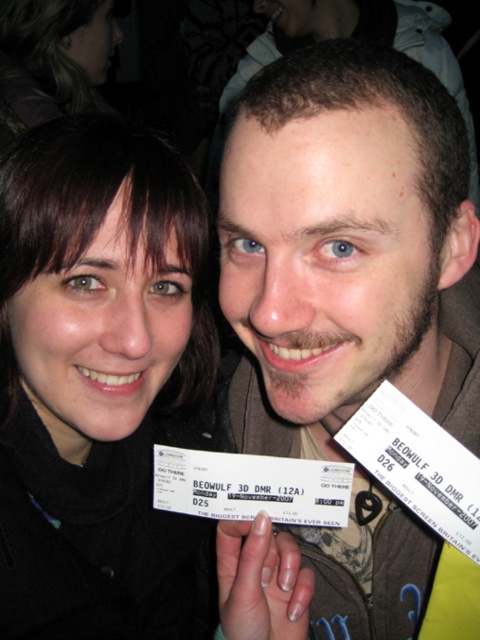
You are a photographer who needs to adjust your camera focus to capture the black matte ticket at center clearly. Given that the camera can focus precisely at point 0.6 on the horizontal axis and 0.2 on the vertical axis, will the ticket be in focus?

The black matte ticket at center is positioned at point 0.598 on the horizontal axis and 0.204 on the vertical axis. Since the camera focuses precisely at 0.6 horizontally and 0.2 vertically, the ticket is very close to the focus point and should be in focus.

You are a photographer standing in front of the two people in the image. You want to focus your camera on the brown textured jacket at center without the black matte ticket at center blocking the view. Is this possible?

The black matte ticket at center is further to the viewer than brown textured jacket at center, so the ticket is closer to you. Therefore, it will block your view of the jacket. You need to move the ticket or adjust your angle to capture the jacket without obstruction.

You are taking a photo of two friends holding tickets. The first friend is at point [176,259] and the second is at point [451,120]. Which friend is closer to the camera?

The friend at point [176,259] is closer to the camera than the friend at point [451,120].